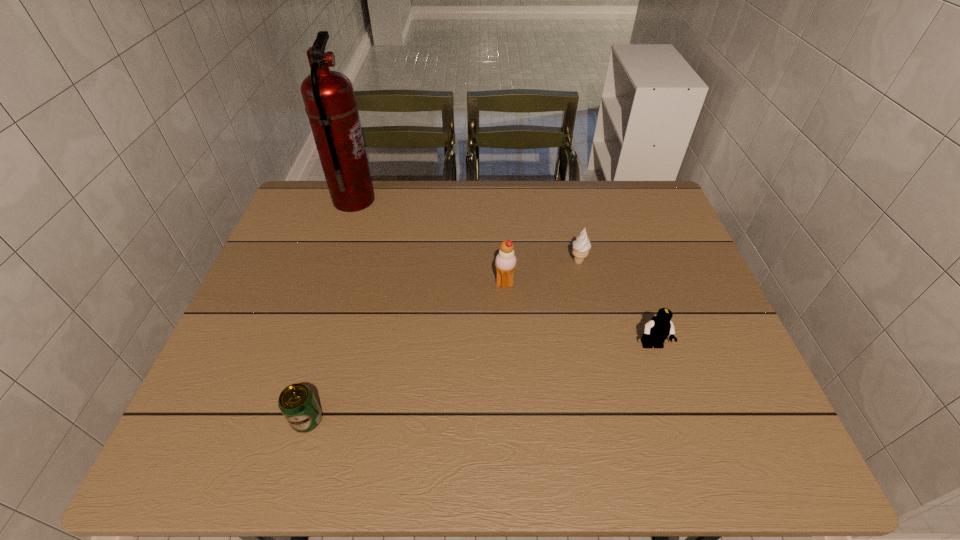
This screenshot has width=960, height=540. Find the location of `free point between the right icecream and the Lego`. free point between the right icecream and the Lego is located at coordinates (615, 304).

Where is `vacant space in between the shortest object and the tallest object`? This screenshot has width=960, height=540. vacant space in between the shortest object and the tallest object is located at coordinates click(x=330, y=310).

Where is `free space between the nearest object and the farthest object`? free space between the nearest object and the farthest object is located at coordinates (330, 310).

Where is `free space between the fire extinguisher and the second tallest object`? free space between the fire extinguisher and the second tallest object is located at coordinates (429, 242).

Where is `vacant area that lies between the shortest object and the Lego`? The width and height of the screenshot is (960, 540). vacant area that lies between the shortest object and the Lego is located at coordinates (480, 383).

I want to click on vacant space that's between the fire extinguisher and the nearest object, so click(330, 310).

Identify the location of the second closest object to the second tallest object. (656, 331).

You are a GUI agent. You are given a task and a screenshot of the screen. Output one action in this format:
    pyautogui.click(x=<x>, y=<y>)
    Task: Click on the object that is the fourth closest to the farther icecream
    
    Given the screenshot: What is the action you would take?
    pyautogui.click(x=297, y=402)

The width and height of the screenshot is (960, 540). Find the location of `vacant space that satisfies the following two spatial constraints: 1. on the front-facing side of the right icecream; 2. at the front with a straw on the third object from left to right`. vacant space that satisfies the following two spatial constraints: 1. on the front-facing side of the right icecream; 2. at the front with a straw on the third object from left to right is located at coordinates (584, 285).

Locate an element on the screen. blank area in the image that satisfies the following two spatial constraints: 1. on the back side of the shortest object; 2. on the nozzle side of the fire extinguisher is located at coordinates (371, 201).